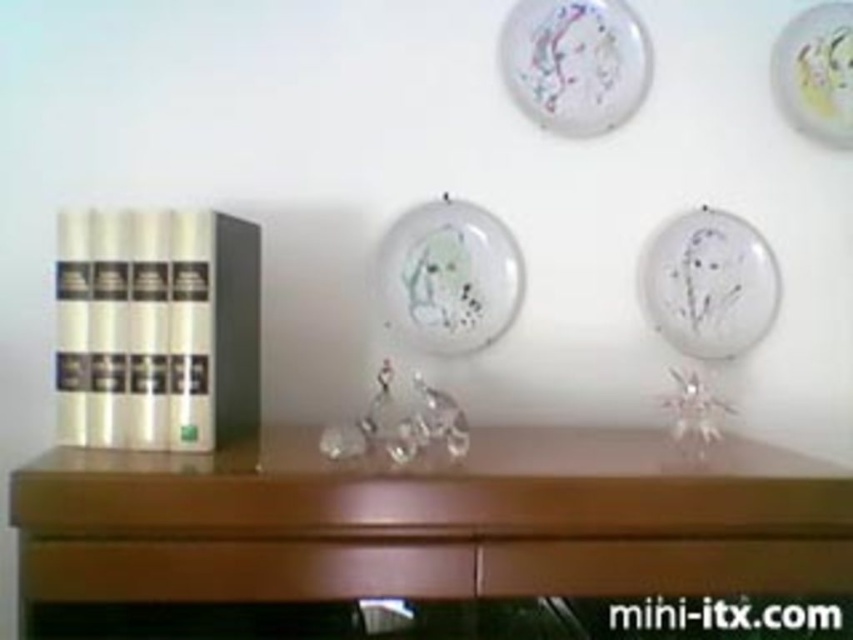
Is brown wood drawer at center positioned at the back of transparent glass plate at upper right?

That is False.

Does point (485, 577) lie in front of point (753, 236)?

Yes, it is in front of point (753, 236).

Identify the location of brown wood drawer at center. (662, 566).

Does porcelain plate at upper center have a lesser width compared to transparent glass plate at upper right?

No, porcelain plate at upper center is not thinner than transparent glass plate at upper right.

Is porcelain plate at upper center further to camera compared to transparent glass plate at upper right?

No, it is in front of transparent glass plate at upper right.

Is point (518, 51) positioned before point (728, 348)?

No, it is behind (728, 348).

The width and height of the screenshot is (853, 640). I want to click on porcelain plate at upper center, so click(x=575, y=61).

Can you confirm if brown wood drawer at center is shorter than white glossy plate at upper right?

Yes, brown wood drawer at center is shorter than white glossy plate at upper right.

Is point (799, 556) positioned before point (815, 122)?

Yes, point (799, 556) is closer to viewer.

Find the location of a particular element. This screenshot has height=640, width=853. brown wood drawer at center is located at coordinates (662, 566).